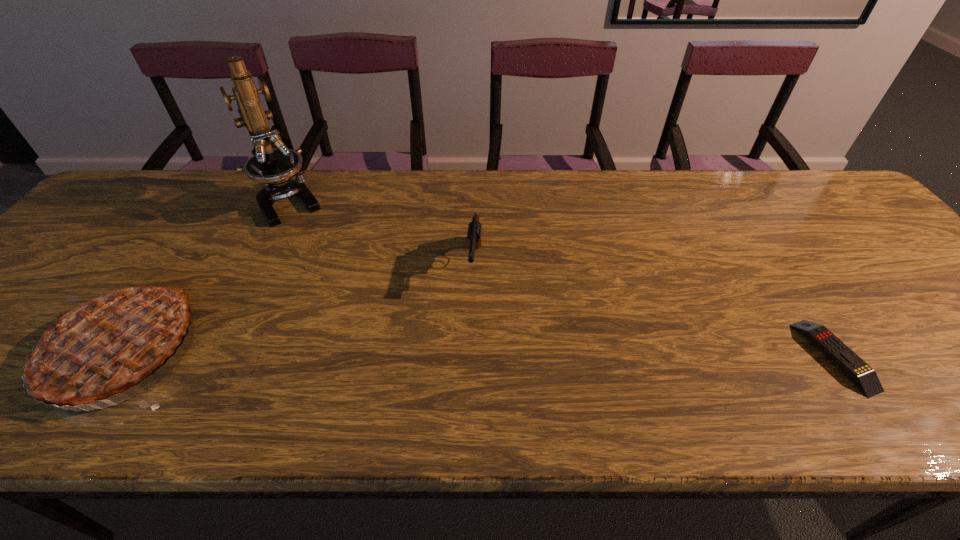
The image size is (960, 540). In order to click on remote control in this screenshot , I will do `click(864, 376)`.

The image size is (960, 540). In order to click on the shortest object in this screenshot , I will do `click(864, 376)`.

Find the location of a particular element. Image resolution: width=960 pixels, height=540 pixels. the second shortest object is located at coordinates (474, 228).

Image resolution: width=960 pixels, height=540 pixels. I want to click on gun, so click(474, 228).

The width and height of the screenshot is (960, 540). I want to click on the farthest object, so click(x=275, y=167).

Find the location of a particular element. This screenshot has height=540, width=960. the tallest object is located at coordinates (275, 167).

Locate an element on the screen. The height and width of the screenshot is (540, 960). vacant space located 0.080m on the back of the remote control is located at coordinates (792, 293).

Find the location of a particular element. The height and width of the screenshot is (540, 960). blank space located 0.090m along the barrel of the second object from right to left is located at coordinates (471, 327).

Where is `vacant space situated along the barrel of the second object from right to left`? The height and width of the screenshot is (540, 960). vacant space situated along the barrel of the second object from right to left is located at coordinates (468, 367).

Locate an element on the screen. vacant space located 0.110m along the barrel of the second object from right to left is located at coordinates (470, 335).